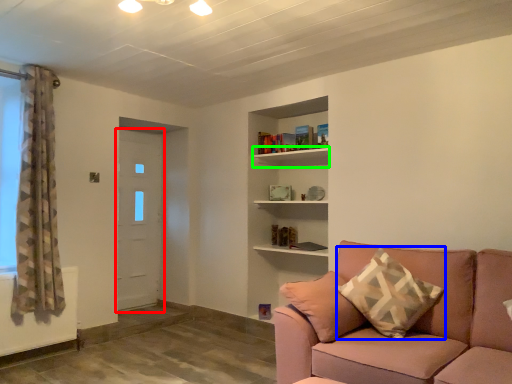
Question: Based on their relative distances, which object is nearer to door (highlighted by a red box)? Choose from pillow (highlighted by a blue box) and shelf (highlighted by a green box).

Choices:
 (A) pillow
 (B) shelf

Answer: (B)